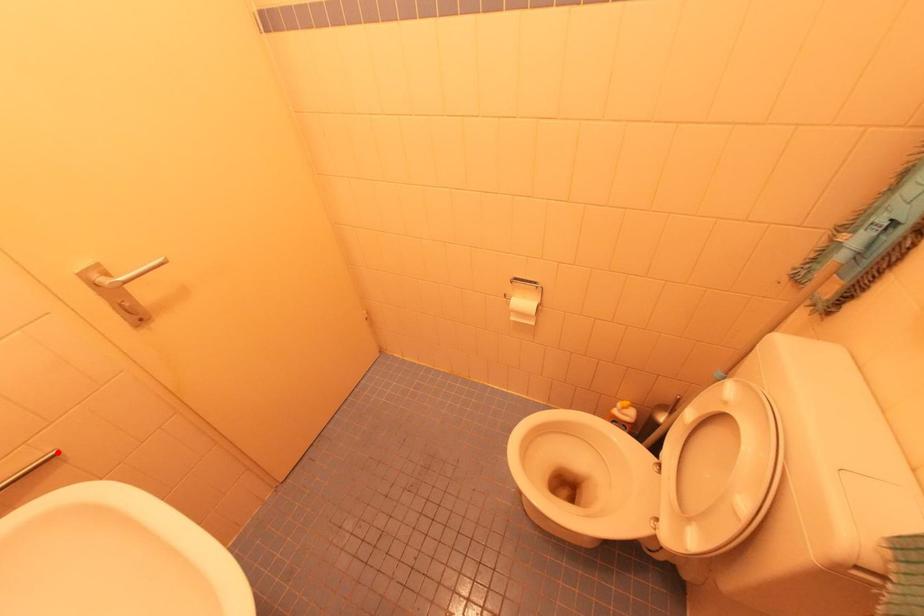
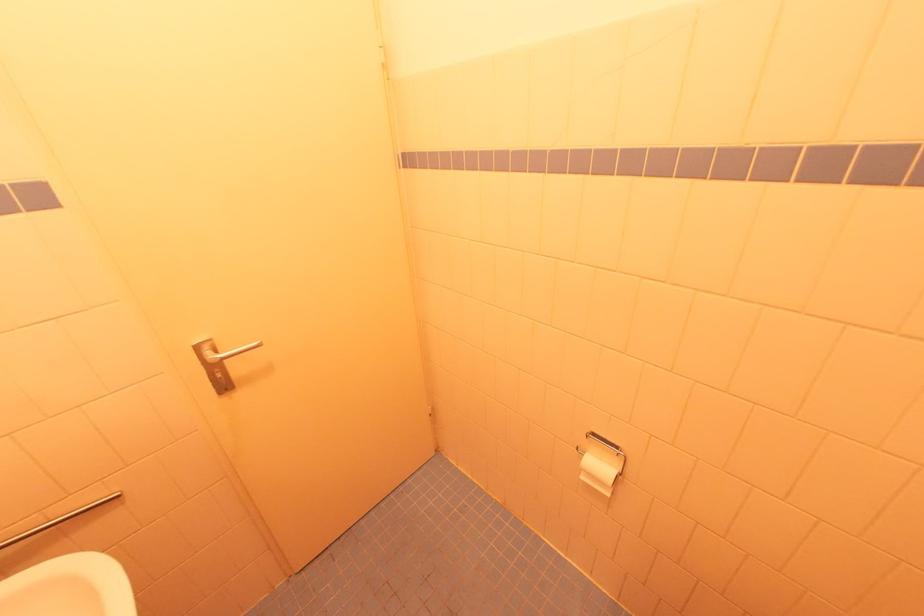
Find the pixel in the second image that matches the highlighted location in the first image.

(120, 495)